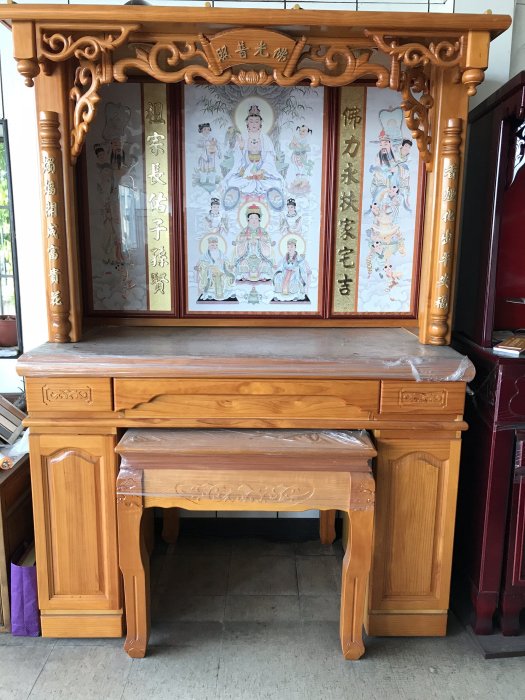
Identify the location of rightmost glass panel. (380, 194).